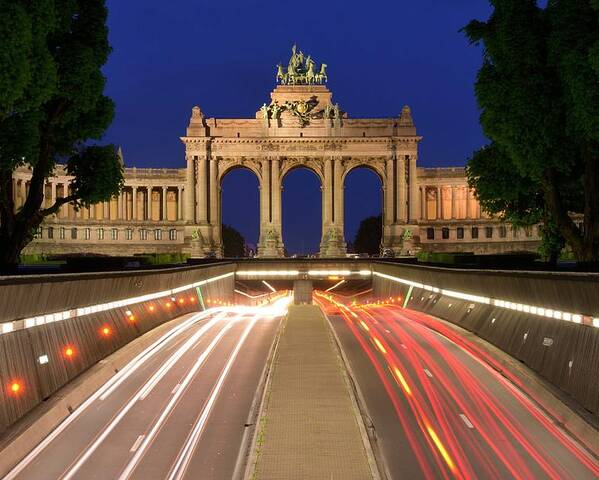
The height and width of the screenshot is (480, 599). Identify the location of orange circle lights. (99, 329), (63, 356), (14, 385).